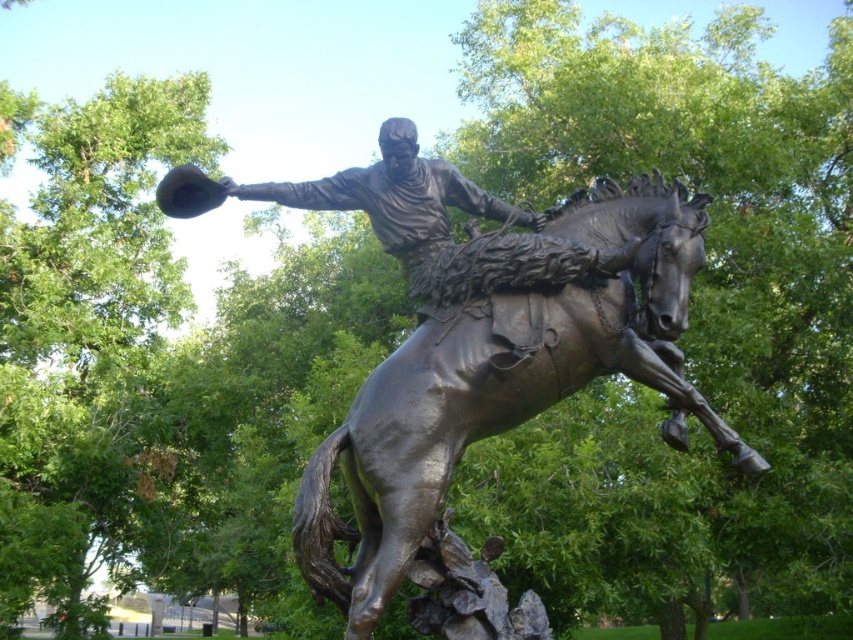
Based on the photo, who is lower down, bronze horse at center or bronze statue at center?

bronze horse at center is lower down.

Is bronze horse at center below bronze statue at center?

Indeed, bronze horse at center is positioned under bronze statue at center.

Who is more distant from viewer, (x=495, y=540) or (x=547, y=276)?

The point (x=495, y=540) is behind.

The width and height of the screenshot is (853, 640). What are the coordinates of `bronze horse at center` in the screenshot? It's located at (498, 412).